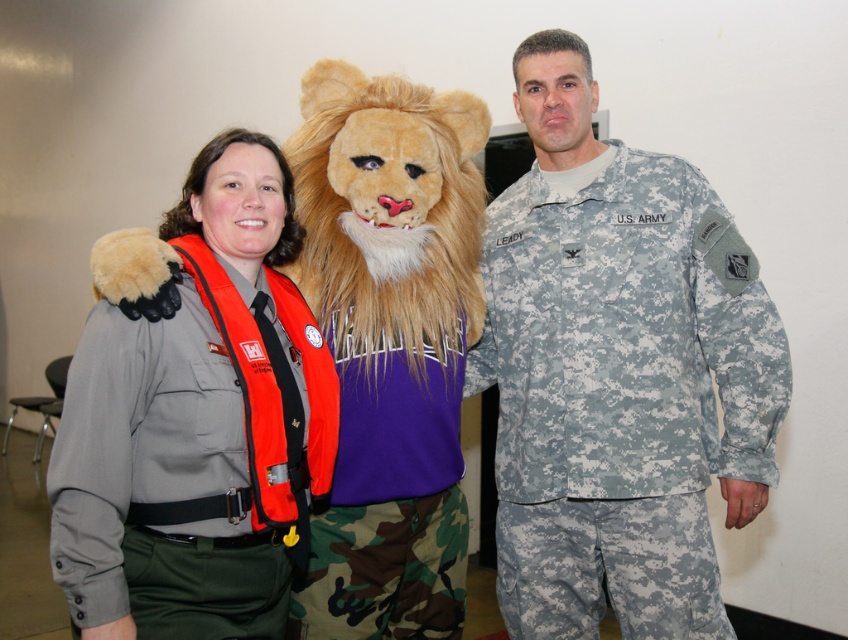
Question: Among these objects, which one is nearest to the camera?

Choices:
 (A) camouflage uniform at center
 (B) gray fabric uniform at center

Answer: (B)

Question: Can you confirm if camouflage uniform at center is positioned to the left of gray fabric uniform at center?

Choices:
 (A) yes
 (B) no

Answer: (B)

Question: Is camouflage uniform at center positioned in front of gray fabric uniform at center?

Choices:
 (A) no
 (B) yes

Answer: (A)

Question: Where is camouflage uniform at center located in relation to gray fabric uniform at center in the image?

Choices:
 (A) left
 (B) right

Answer: (B)